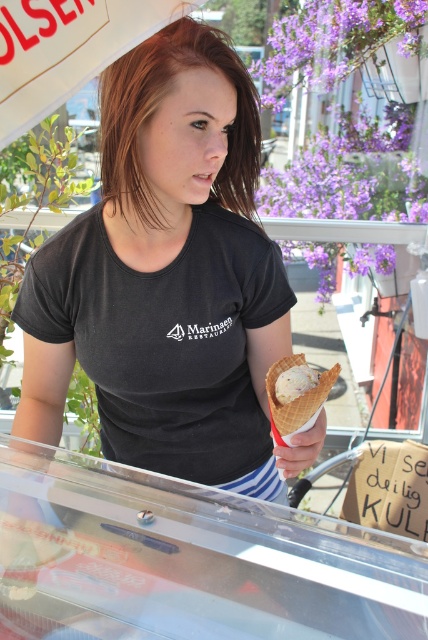
Question: Which of the following is the farthest from the observer?

Choices:
 (A) (261, 417)
 (B) (291, 387)
 (C) (323, 388)

Answer: (A)

Question: Does black matte t-shirt at center have a greater width compared to vanilla ice cream in waffle cone at center?

Choices:
 (A) yes
 (B) no

Answer: (A)

Question: Which object appears closest to the camera in this image?

Choices:
 (A) white creamy ice cream at center
 (B) vanilla ice cream in waffle cone at center

Answer: (B)

Question: Is black matte t-shirt at center closer to camera compared to white creamy ice cream at center?

Choices:
 (A) yes
 (B) no

Answer: (B)

Question: Is black matte t-shirt at center closer to the viewer compared to white creamy ice cream at center?

Choices:
 (A) no
 (B) yes

Answer: (A)

Question: Estimate the real-world distances between objects in this image. Which object is closer to the black matte t-shirt at center?

Choices:
 (A) vanilla ice cream in waffle cone at center
 (B) white creamy ice cream at center

Answer: (A)